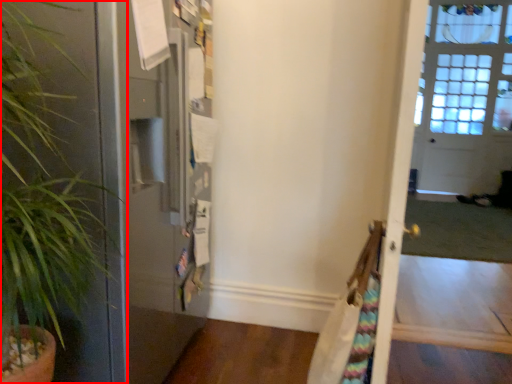
Question: From the image's perspective, considering the relative positions of houseplant (annotated by the red box) and screen door in the image provided, where is houseplant (annotated by the red box) located with respect to the staircase?

Choices:
 (A) below
 (B) above

Answer: (A)